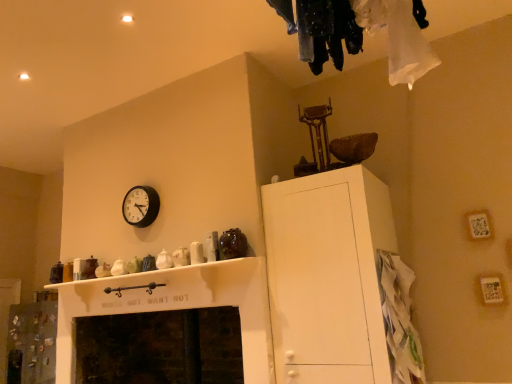
Question: Is dark stone fireplace at lower center wider or thinner than white paper bag at lower right?

Choices:
 (A) thin
 (B) wide

Answer: (B)

Question: Which is correct: dark stone fireplace at lower center is inside white paper bag at lower right, or outside of it?

Choices:
 (A) outside
 (B) inside

Answer: (A)

Question: Which of these objects is positioned closest to the white matte cabinet at upper right?

Choices:
 (A) dark stone fireplace at lower center
 (B) white paper bag at lower right
 (C) black plastic clock at upper left

Answer: (B)

Question: Considering the real-world distances, which object is farthest from the white paper bag at lower right?

Choices:
 (A) black plastic clock at upper left
 (B) white matte cabinet at upper right
 (C) dark stone fireplace at lower center

Answer: (C)